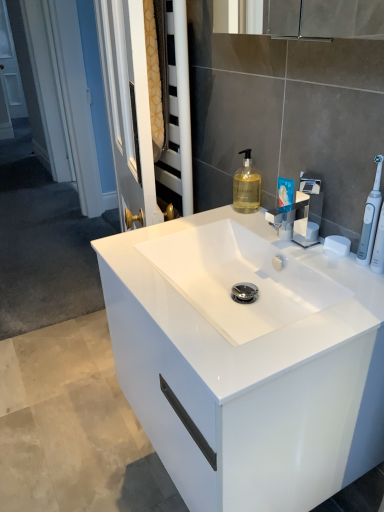
Find the location of a particular element. This screenshot has height=512, width=384. free point behind blue glossy toothpaste tube at upper right is located at coordinates (254, 219).